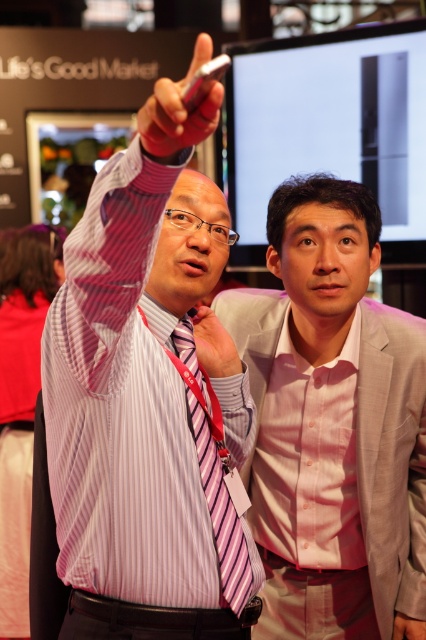
Consider the image. Is pink satin shirt at center to the right of striped fabric shirt at left from the viewer's perspective?

Yes, pink satin shirt at center is to the right of striped fabric shirt at left.

Is point (382, 483) less distant than point (23, 452)?

Yes, point (382, 483) is in front of point (23, 452).

At what (x,y) coordinates should I click in order to perform the action: click on pink satin shirt at center. Please return your answer as a coordinate pair (x, y). The width and height of the screenshot is (426, 640). Looking at the image, I should click on click(x=333, y=424).

Who is positioned more to the right, pink striped tie at center or matte pink phone at upper center?

From the viewer's perspective, pink striped tie at center appears more on the right side.

This screenshot has width=426, height=640. What do you see at coordinates (213, 474) in the screenshot?
I see `pink striped tie at center` at bounding box center [213, 474].

What do you see at coordinates (213, 474) in the screenshot? This screenshot has width=426, height=640. I see `pink striped tie at center` at bounding box center [213, 474].

Locate an element on the screen. The width and height of the screenshot is (426, 640). pink striped tie at center is located at coordinates (213, 474).

Does point (150, 131) come farther from viewer compared to point (224, 346)?

No, (150, 131) is in front of (224, 346).

This screenshot has height=640, width=426. Find the location of `matte pink phone at upper center`. matte pink phone at upper center is located at coordinates (x=180, y=109).